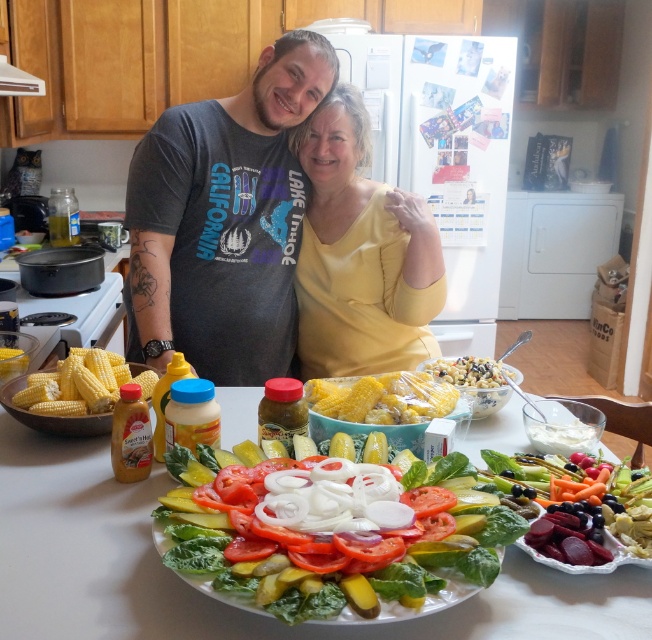
You are setting up a table for a dinner party and want to arrange the white ceramic plate at center and the fresh green salad at center so that they are both visible to guests. Given their sizes, which one should you place closer to the edge of the table to ensure visibility?

The white ceramic plate at center is taller than the fresh green salad at center, so to ensure both are visible, place the taller white ceramic plate at center closer to the edge of the table so it doesn

In the kitchen scene, there is a yellow matte shirt at center and a yellow corn at center. Which object is bigger in size?

The yellow matte shirt at center is larger in size compared to the yellow corn at center.

In the kitchen scene, there is a white ceramic plate at center and a fresh green salad at center. Which object is wider?

The white ceramic plate at center is wider than the fresh green salad at center.